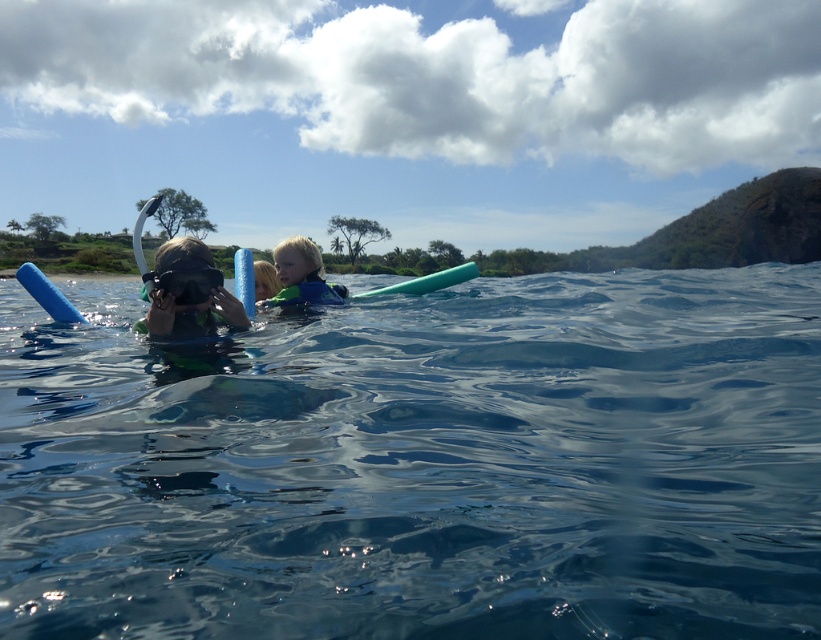
From the picture: Who is shorter, blue rubber ring at center or blue foam paddle at upper left?

Standing shorter between the two is blue foam paddle at upper left.

Can you confirm if blue rubber ring at center is positioned to the right of blue foam paddle at upper left?

Indeed, blue rubber ring at center is positioned on the right side of blue foam paddle at upper left.

Is point (282, 250) farther from camera compared to point (72, 317)?

Yes, point (282, 250) is farther from viewer.

In order to click on blue rubber ring at center in this screenshot , I will do `click(301, 275)`.

Who is more distant from viewer, [817,301] or [49,310]?

Positioned behind is point [817,301].

Looking at this image, does clear blue water at center lie behind blue foam paddle at upper left?

That is False.

Is point (384, 605) farther from viewer compared to point (31, 268)?

No, (384, 605) is in front of (31, 268).

Find the location of `clear blue water at center`. clear blue water at center is located at coordinates (422, 464).

The width and height of the screenshot is (821, 640). What do you see at coordinates (422, 464) in the screenshot? I see `clear blue water at center` at bounding box center [422, 464].

Identify the location of clear blue water at center. The width and height of the screenshot is (821, 640). (422, 464).

Image resolution: width=821 pixels, height=640 pixels. I want to click on clear blue water at center, so click(x=422, y=464).

At what (x,y) coordinates should I click in order to perform the action: click on clear blue water at center. Please return your answer as a coordinate pair (x, y). The image size is (821, 640). Looking at the image, I should click on (422, 464).